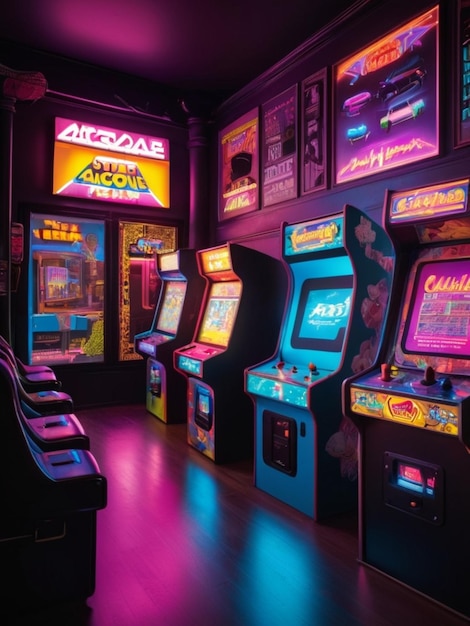
This screenshot has height=626, width=470. Identify the location of floor. (366, 608).